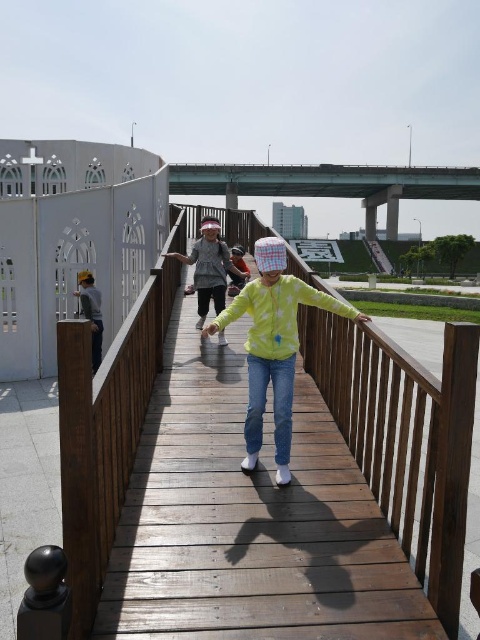
Question: Can you confirm if wooden rail at center is thinner than dark gray jacket at left?

Choices:
 (A) no
 (B) yes

Answer: (A)

Question: Is wooden rail at center positioned in front of dark gray jacket at left?

Choices:
 (A) yes
 (B) no

Answer: (A)

Question: Among these objects, which one is farthest from the camera?

Choices:
 (A) yellow matte jacket at center
 (B) dark gray jacket at left

Answer: (B)

Question: Among these objects, which one is nearest to the camera?

Choices:
 (A) yellow matte jacket at center
 (B) wooden bridge at center

Answer: (A)

Question: Is light yellow fabric shirt at center wider than dark gray jacket at left?

Choices:
 (A) no
 (B) yes

Answer: (B)

Question: Which of these objects is positioned closest to the wooden rail at center?

Choices:
 (A) light yellow fabric shirt at center
 (B) yellow matte jacket at center
 (C) wooden bridge at center
 (D) dark gray jacket at left

Answer: (A)